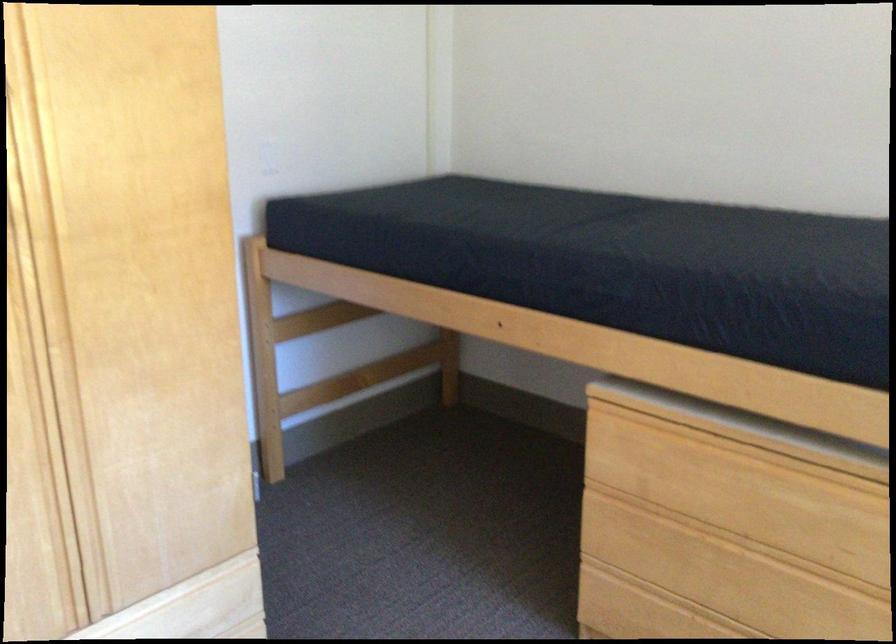
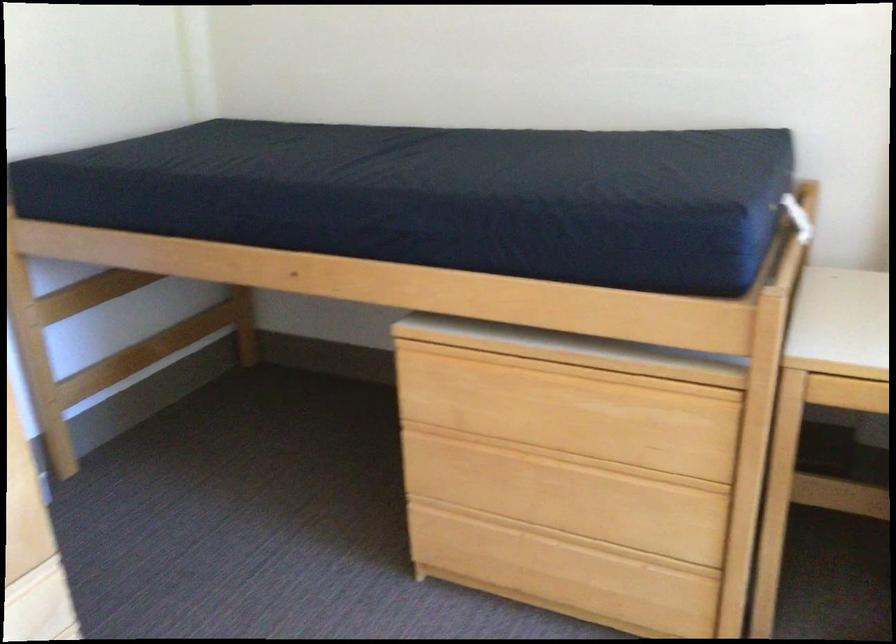
Question: The first image is from the beginning of the video and the second image is from the end. How did the camera likely rotate when shooting the video?

Choices:
 (A) Left
 (B) Right
 (C) Up
 (D) Down

Answer: (B)